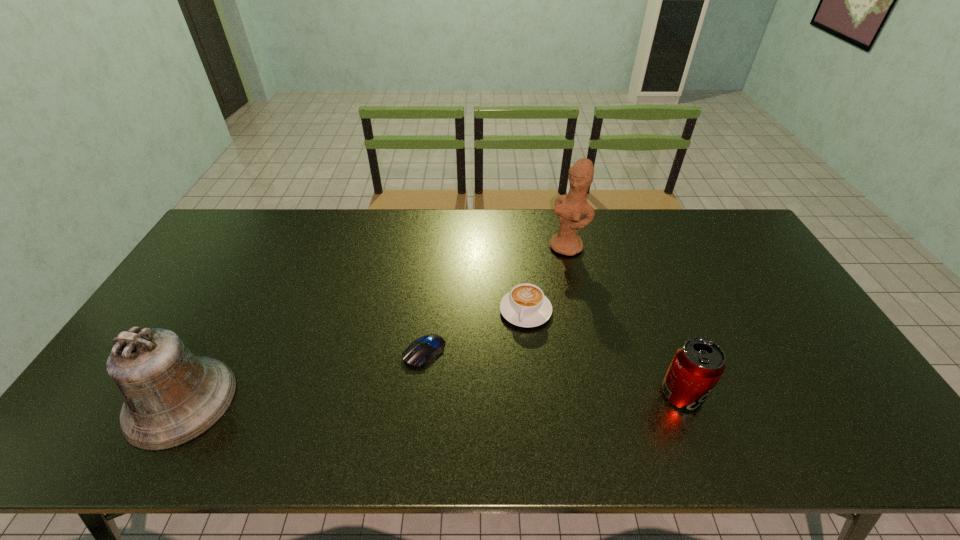
Locate an element on the screen. empty space that is in between the fourth nearest object and the fourth shortest object is located at coordinates (353, 356).

At what (x,y) coordinates should I click in order to perform the action: click on vacant space that's between the second tallest object and the second shortest object. Please return your answer as a coordinate pair (x, y). The width and height of the screenshot is (960, 540). Looking at the image, I should click on click(x=353, y=356).

I want to click on free space between the farthest object and the bell, so click(374, 324).

The width and height of the screenshot is (960, 540). I want to click on vacant space that is in between the fourth object from left to right and the second tallest object, so click(374, 324).

Find the location of a particular element. This screenshot has width=960, height=540. unoccupied position between the second tallest object and the soda can is located at coordinates (432, 397).

Identify the location of free space between the soda can and the bell. (432, 397).

Locate an element on the screen. This screenshot has width=960, height=540. free space that is in between the third tallest object and the third object from right to left is located at coordinates (604, 352).

The height and width of the screenshot is (540, 960). Identify the location of vacant space that is in between the leftmost object and the computer mouse. (302, 376).

Where is `empty space that is in between the third object from left to right and the farthest object`? empty space that is in between the third object from left to right and the farthest object is located at coordinates (546, 279).

The image size is (960, 540). In order to click on unoccupied area between the shortest object and the soda can in this screenshot , I will do (553, 373).